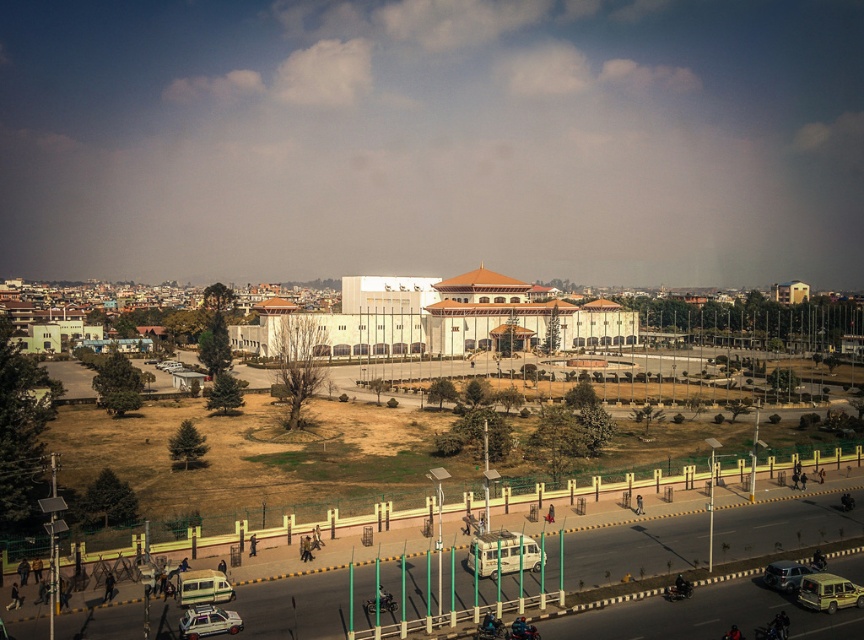
In the scene shown: You are a delivery driver who needs to park your 5.5 meter long truck between the white matte car at lower left and the metallic silver car at lower right. Can you fit your truck there without overlapping either vehicle?

The distance between the white matte car at lower left and the metallic silver car at lower right is 24.60 meters. Since your truck is only 5.5 meters long, there is sufficient space to park it between them without overlapping either vehicle.

You are a photographer planning to take a photo of the white glossy building at center and the metallic silver car at lower right. To ensure both subjects are in focus, you need to know their relative sizes. Based on the scene description, which object is significantly larger?

The white glossy building at center is much taller than the metallic silver car at lower right, making it significantly larger.